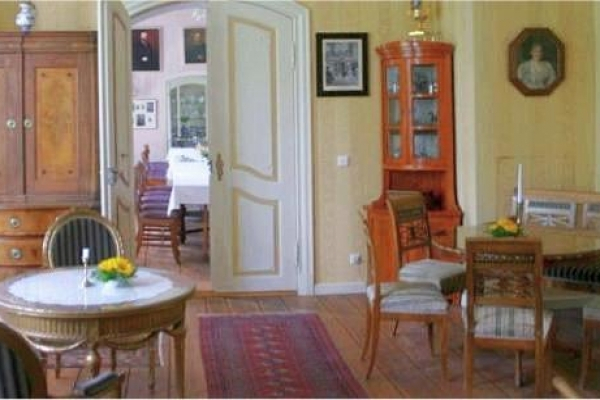
The width and height of the screenshot is (600, 400). I want to click on picture, so click(342, 75), click(147, 117).